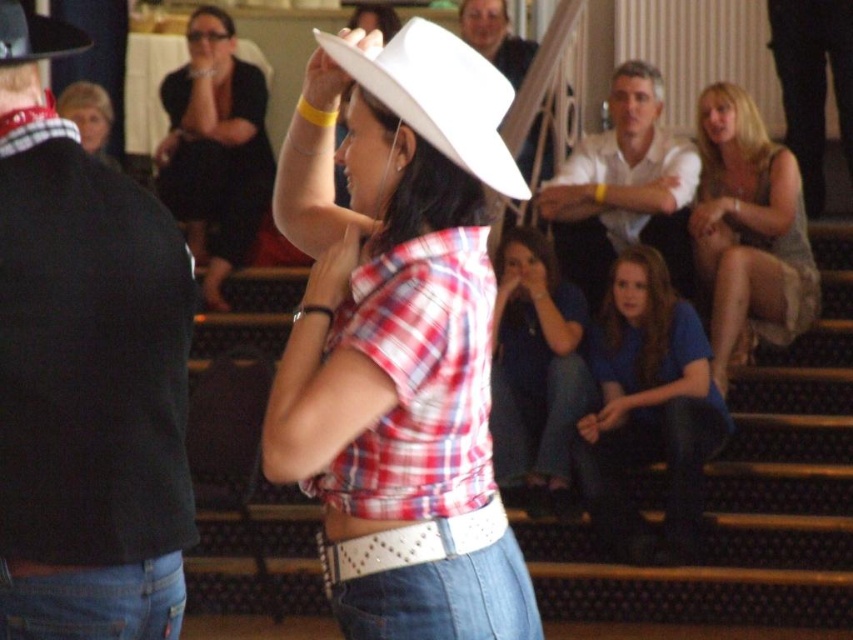
Question: Is matte black dress at upper left thinner than denim jeans at center?

Choices:
 (A) yes
 (B) no

Answer: (B)

Question: Does white cotton shirt at upper center come in front of smooth white shirt at upper center?

Choices:
 (A) yes
 (B) no

Answer: (A)

Question: Which of the following is the closest to the observer?

Choices:
 (A) (502, 364)
 (B) (799, 308)

Answer: (A)

Question: Is black leather jacket at left thinner than plaid fabric at center?

Choices:
 (A) yes
 (B) no

Answer: (A)

Question: Which point is closer to the camera?

Choices:
 (A) denim jeans at center
 (B) matte black cowboy hat at upper left

Answer: (A)

Question: Which is nearer to the white matte fedora at center?

Choices:
 (A) white matte cowboy hat at center
 (B) black leather jacket at left
 (C) black leather pants at right

Answer: (A)